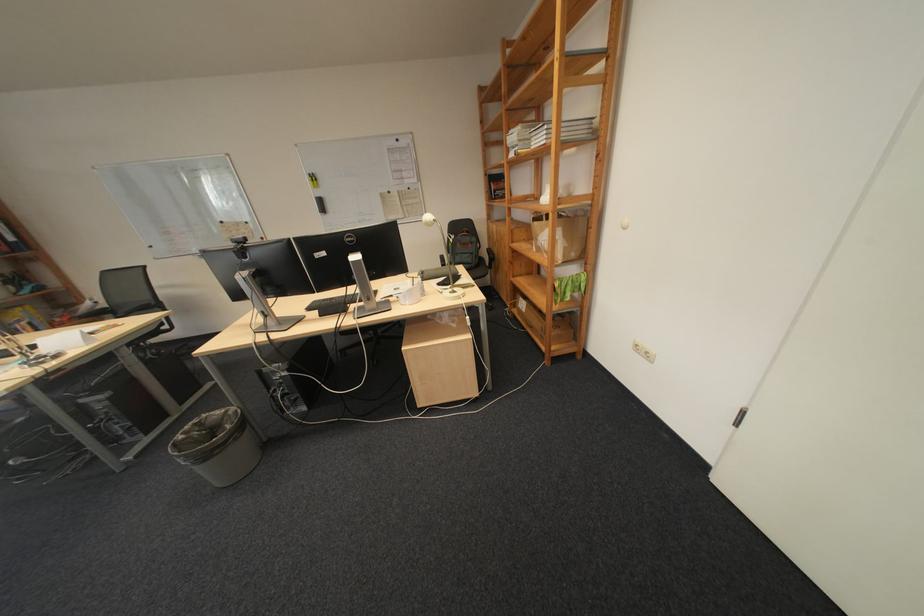
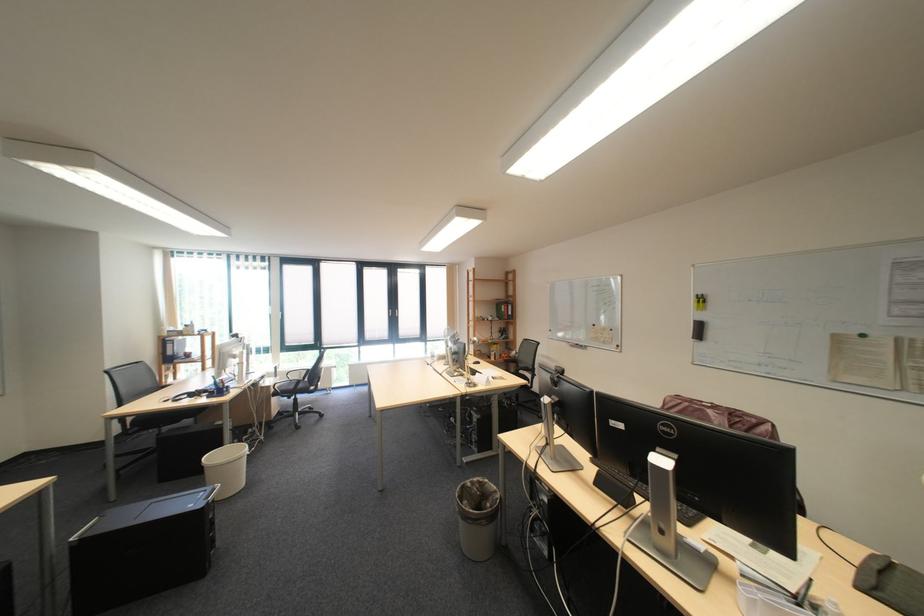
Where in the second image is the point corresponding to the point at 164,358 from the first image?

(519, 406)